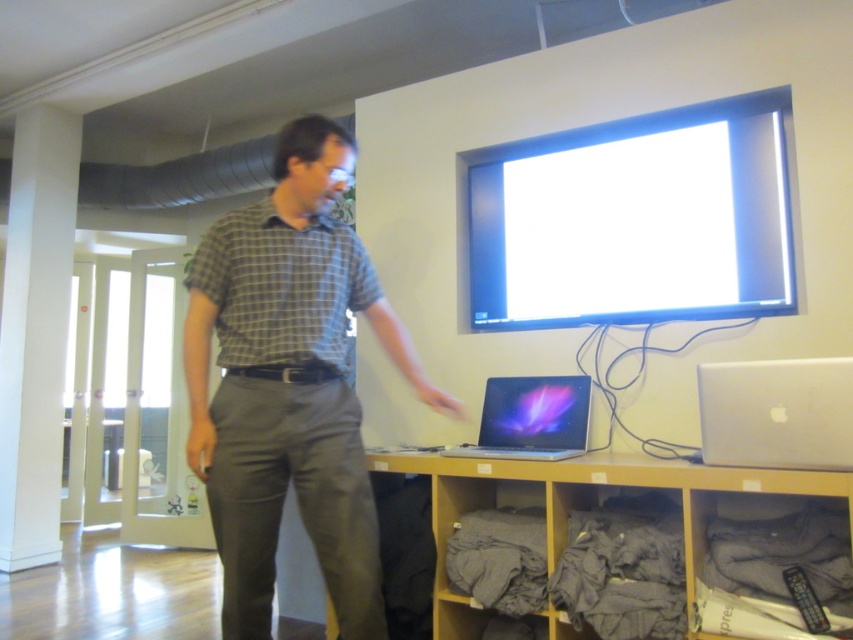
Does white glossy screen at upper center appear over glossy plastic laptop at lower center?

Yes.

Is white glossy screen at upper center below glossy plastic laptop at lower center?

No.

Is point (758, 177) closer to viewer compared to point (567, 435)?

Yes, point (758, 177) is in front of point (567, 435).

The image size is (853, 640). In order to click on white glossy screen at upper center in this screenshot , I will do (634, 221).

Is plaid shirt at center below wooden shelf at lower center?

No.

Locate an element on the screen. This screenshot has width=853, height=640. plaid shirt at center is located at coordinates (289, 385).

Is point (297, 230) less distant than point (503, 474)?

Yes, it is in front of point (503, 474).

At what (x,y) coordinates should I click in order to perform the action: click on plaid shirt at center. Please return your answer as a coordinate pair (x, y). The image size is (853, 640). Looking at the image, I should click on (289, 385).

Does point (248, 214) come farther from viewer compared to point (764, 467)?

No, it is in front of (764, 467).

This screenshot has height=640, width=853. What are the coordinates of `plaid shirt at center` in the screenshot? It's located at (289, 385).